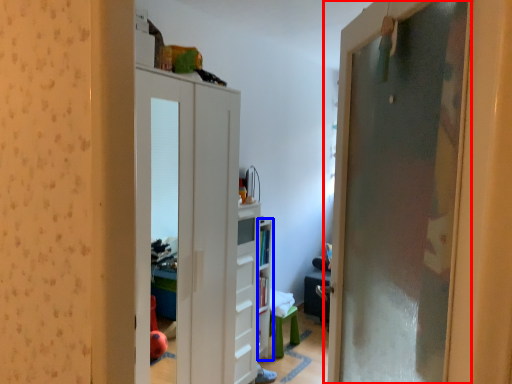
Question: Which object is further to the camera taking this photo, door (highlighted by a red box) or shelf (highlighted by a blue box)?

Choices:
 (A) door
 (B) shelf

Answer: (B)